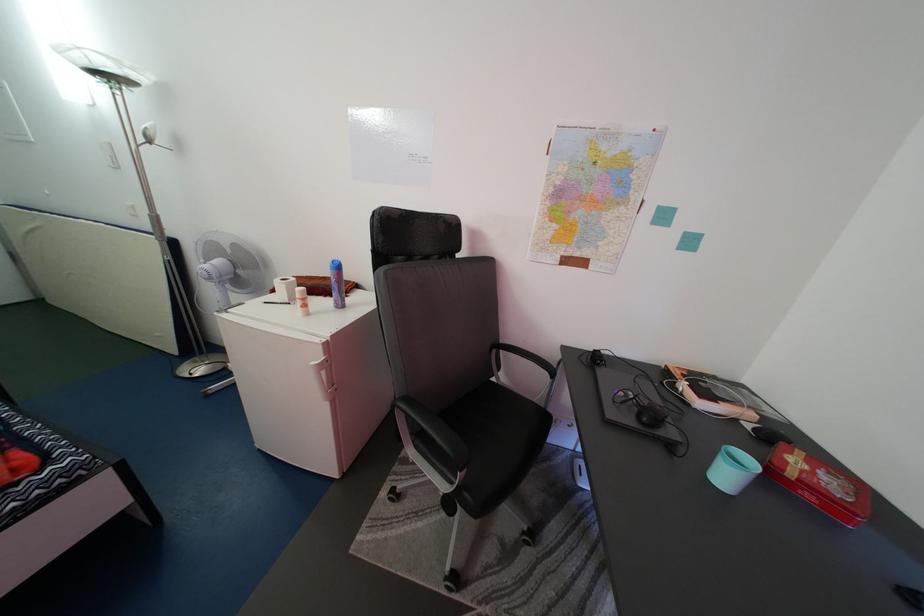
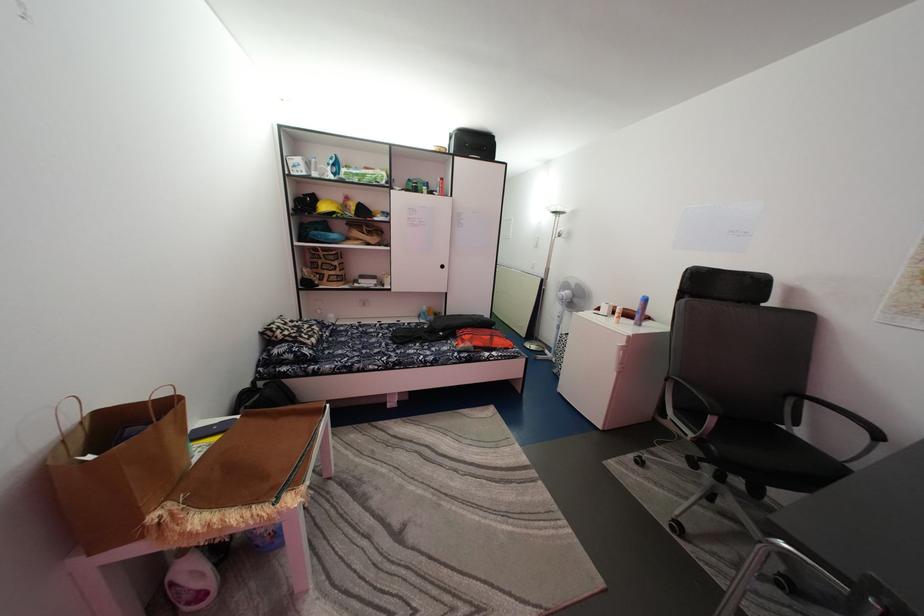
Locate, in the second image, the point that corresponds to [553,381] in the first image.

(871, 440)